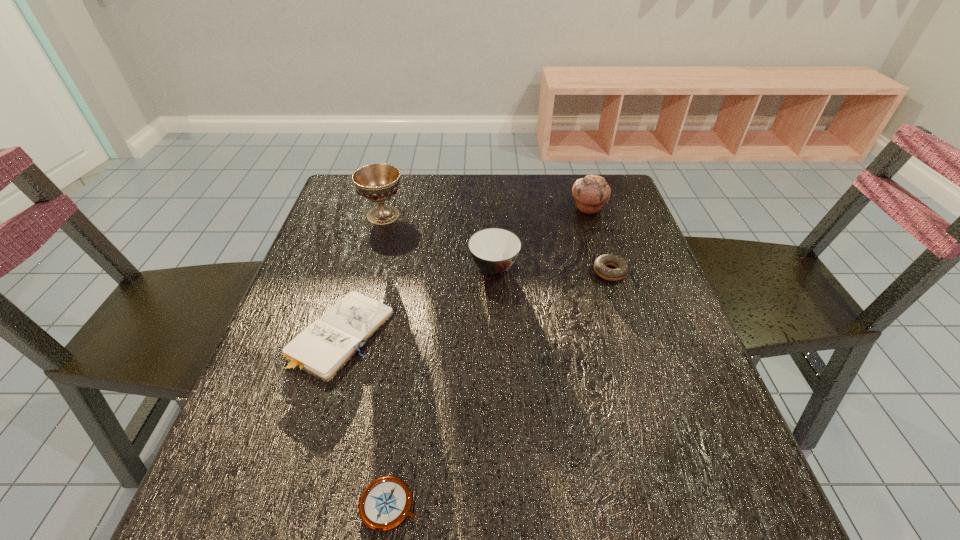
What are the coordinates of `vacant space in between the chalice and the shortest object` in the screenshot? It's located at (387, 360).

At what (x,y) coordinates should I click in order to perform the action: click on free space between the chalice and the soup bowl. Please return your answer as a coordinate pair (x, y). Looking at the image, I should click on (439, 241).

The width and height of the screenshot is (960, 540). I want to click on empty space that is in between the soup bowl and the doughnut, so click(x=552, y=269).

At what (x,y) coordinates should I click in order to perform the action: click on unoccupied position between the notebook and the muffin. Please return your answer as a coordinate pair (x, y). Looking at the image, I should click on (465, 271).

At what (x,y) coordinates should I click in order to perform the action: click on blank region between the doughnut and the fourth object from left to right. Please return your answer as a coordinate pair (x, y). Looking at the image, I should click on (552, 269).

Image resolution: width=960 pixels, height=540 pixels. I want to click on vacant area that lies between the fifth tallest object and the tallest object, so click(x=362, y=274).

This screenshot has height=540, width=960. Identify the location of free spot between the doughnut and the compass. (500, 388).

Where is `object that is the third nearest to the muffin`? This screenshot has height=540, width=960. object that is the third nearest to the muffin is located at coordinates (377, 182).

You are a GUI agent. You are given a task and a screenshot of the screen. Output one action in this format:
    pyautogui.click(x=<x>, y=<y>)
    Task: Click on the object that ranks as the closest to the second shortest object
    This screenshot has height=540, width=960.
    Given the screenshot: What is the action you would take?
    pyautogui.click(x=494, y=250)

Locate an element on the screen. The image size is (960, 540). vacant point that satisfies the following two spatial constraints: 1. on the back side of the chalice; 2. on the right side of the fifth farthest object is located at coordinates (375, 215).